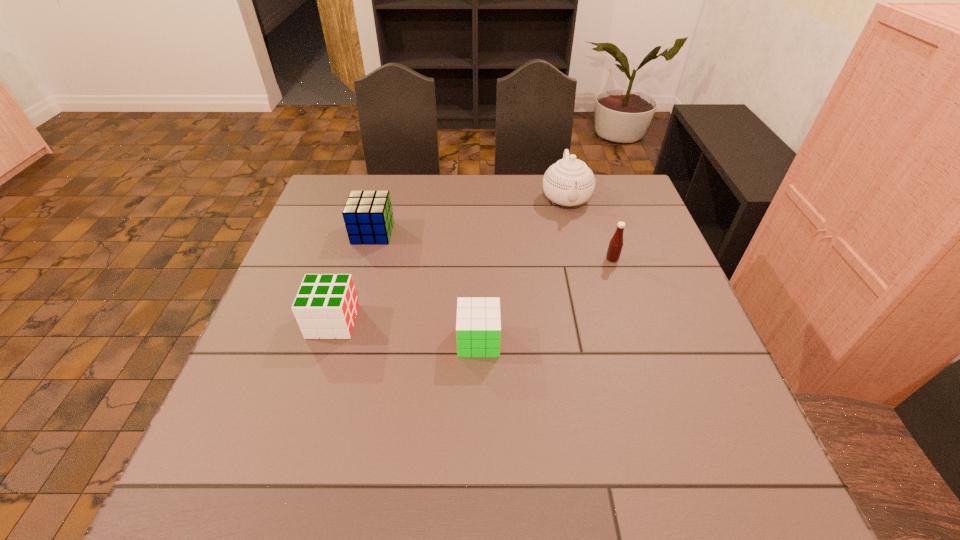
Where is `chinaware at the right edge`? Image resolution: width=960 pixels, height=540 pixels. chinaware at the right edge is located at coordinates click(569, 182).

At what (x,y) coordinates should I click in order to perform the action: click on Tabasco sauce present at the right edge. Please return your answer as a coordinate pair (x, y). This screenshot has height=540, width=960. Looking at the image, I should click on click(x=615, y=246).

This screenshot has width=960, height=540. What are the coordinates of `object that is at the far right corner` in the screenshot? It's located at (569, 182).

Find the location of a particular element. Image resolution: width=960 pixels, height=540 pixels. free space at the far edge of the desktop is located at coordinates (473, 216).

In the image, there is a desktop. Where is `vacant area at the near edge`? The height and width of the screenshot is (540, 960). vacant area at the near edge is located at coordinates (427, 494).

Locate an element on the screen. vacant position at the left edge of the desktop is located at coordinates (298, 414).

In the image, there is a desktop. In order to click on vacant space at the right edge in this screenshot , I will do `click(627, 276)`.

The image size is (960, 540). Identify the location of vacant area at the far left corner. (334, 183).

In the image, there is a desktop. Identify the location of free region at the near left corner. The width and height of the screenshot is (960, 540). (208, 477).

Where is `free space at the far right corner of the desktop`? free space at the far right corner of the desktop is located at coordinates (612, 199).